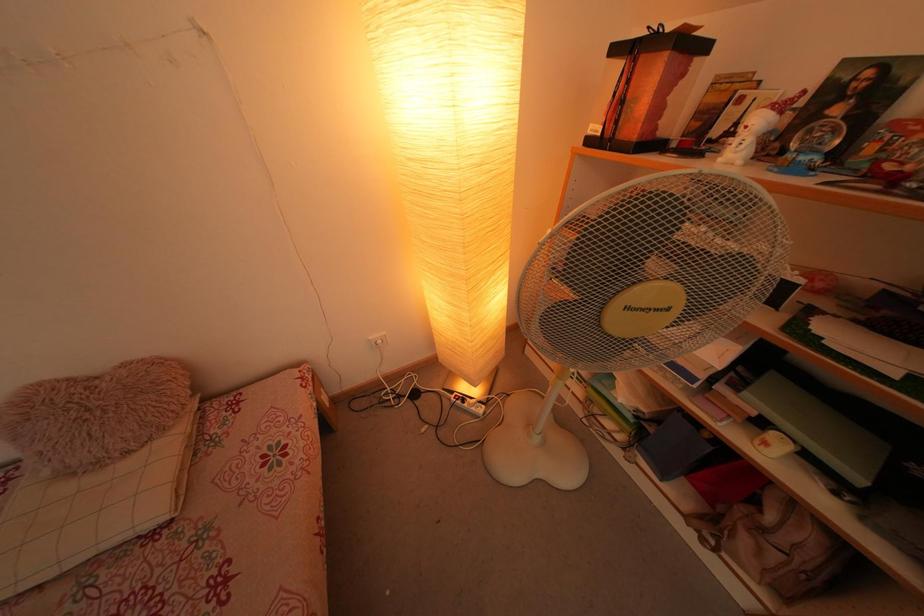
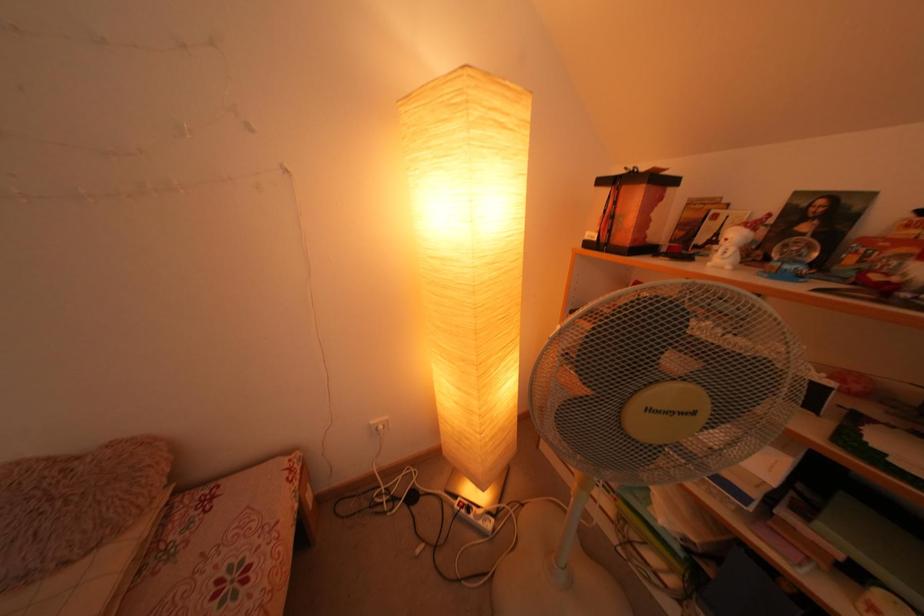
Question: Based on the continuous images, in which direction is the camera rotating? Reply with the corresponding letter.

Choices:
 (A) Left
 (B) Right
 (C) Up
 (D) Down

Answer: (C)